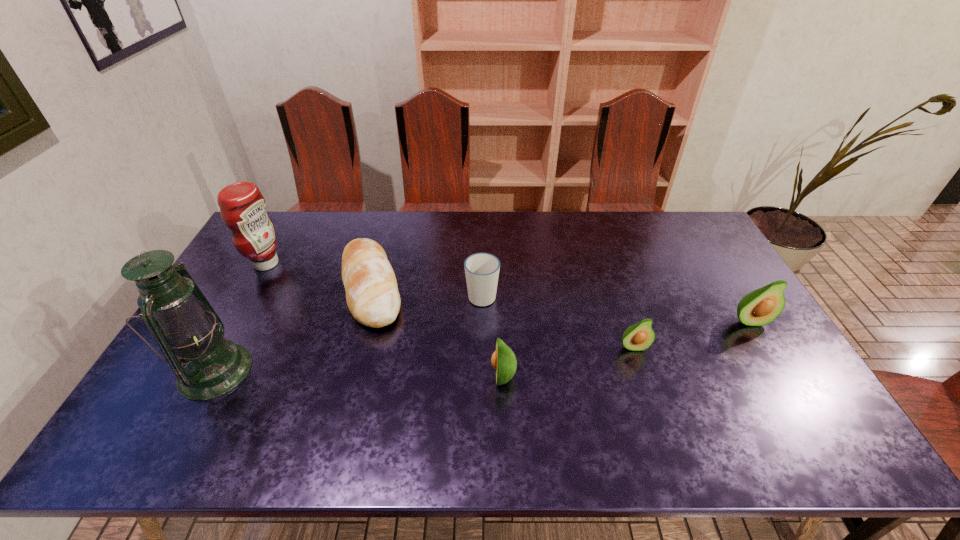
Where is `blank region between the farthest avocado and the sixth shortest object`? This screenshot has width=960, height=540. blank region between the farthest avocado and the sixth shortest object is located at coordinates (508, 292).

The image size is (960, 540). Identify the location of vacant region between the farthest avocado and the bread. (560, 305).

Where is `the closest object to the second tallest object`? Image resolution: width=960 pixels, height=540 pixels. the closest object to the second tallest object is located at coordinates (372, 295).

Select which object is the closest to the cup. Please provide its 2D coordinates. Your answer should be formatted as a tuple, i.e. [(x, y)], where the tuple contains the x and y coordinates of a point satisfying the conditions above.

[(372, 295)]

Locate which avocado is the second closest to the sixth object from left to right. Please provide its 2D coordinates. Your answer should be formatted as a tuple, i.e. [(x, y)], where the tuple contains the x and y coordinates of a point satisfying the conditions above.

[(503, 360)]

I want to click on avocado that can be found as the closest to the nearest avocado, so click(x=640, y=336).